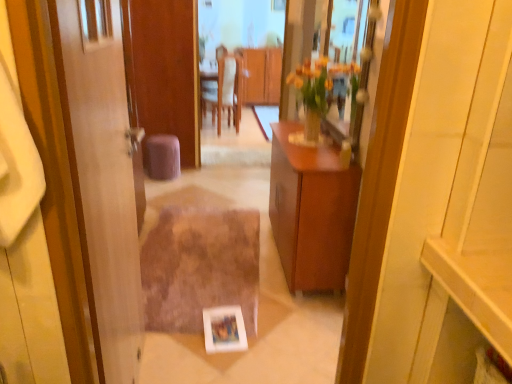
Identify the location of vacant space in front of wooden cabinet at center, placed as the 2th cabinetry when sorted from back to front. (282, 324).